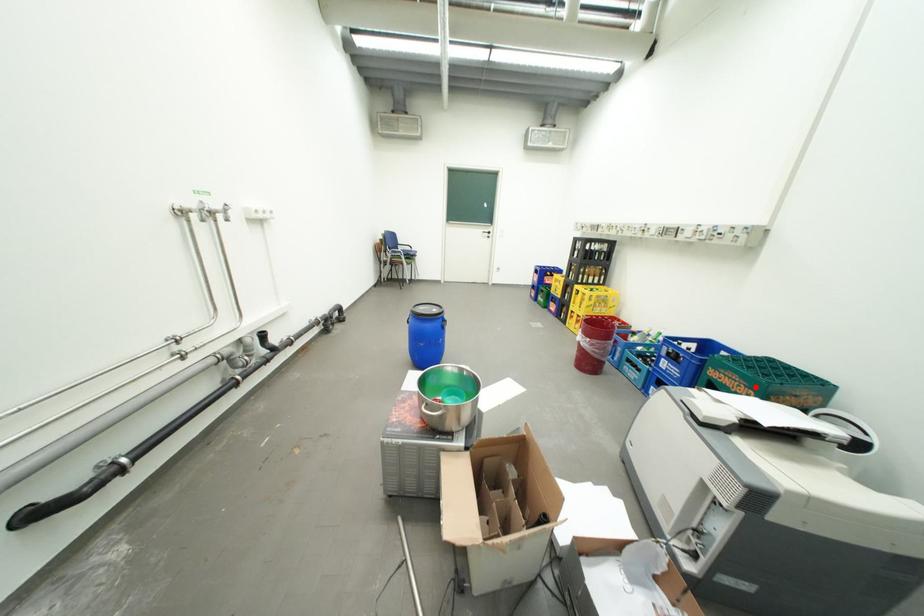
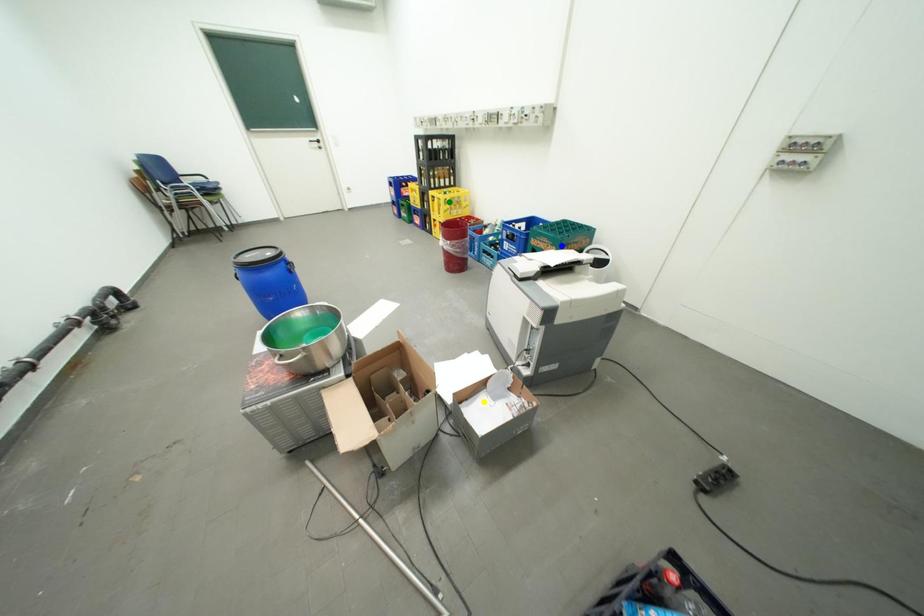
Question: I am providing you with two images of the same scene from different viewpoints. A red point is marked on the first image. You are given multiple points on the second image. Which mark in image 2 goes with the point in image 1?

Choices:
 (A) blue point
 (B) yellow point
 (C) green point

Answer: (A)